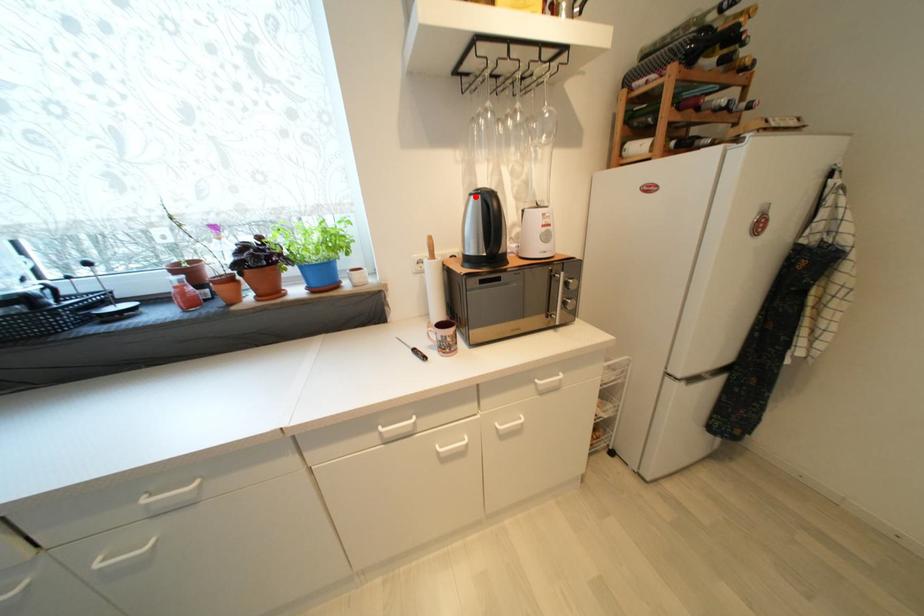
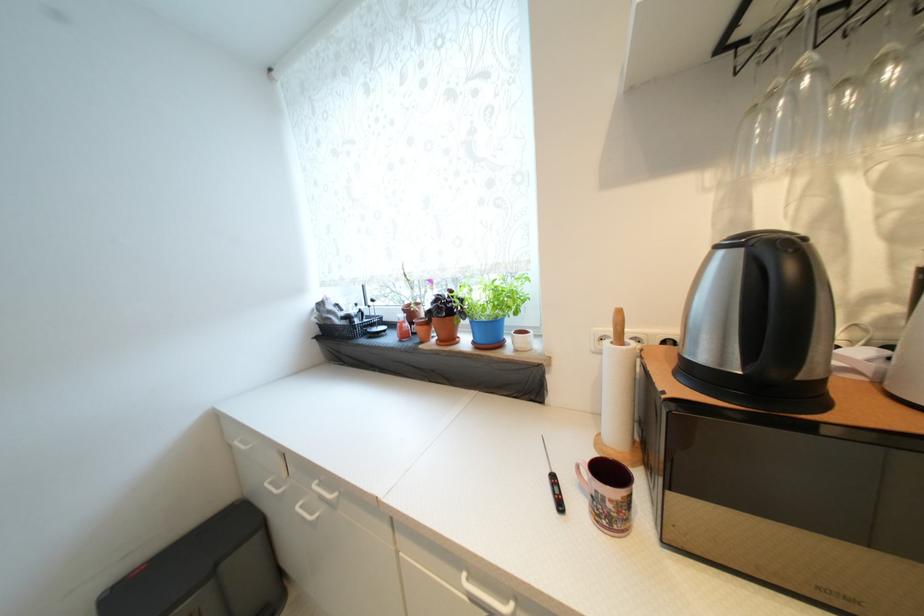
The point at the highlighted location is marked in the first image. Where is the corresponding point in the second image?

(723, 249)